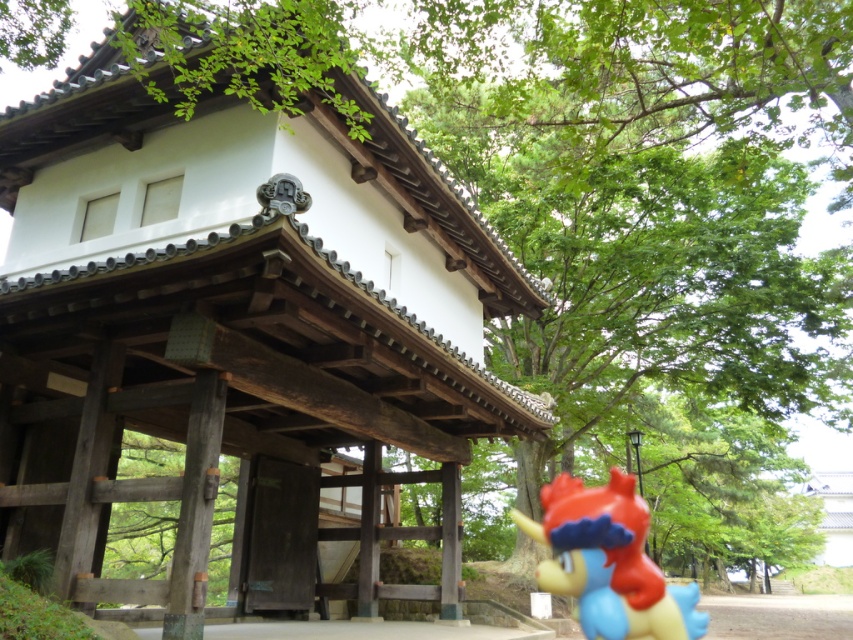
The image size is (853, 640). What are the coordinates of `wooden gate at center` in the screenshot? It's located at (241, 332).

How much distance is there between wooden gate at center and matte plastic toy at center?

They are 18.49 feet apart.

This screenshot has width=853, height=640. In order to click on wooden gate at center in this screenshot , I will do `click(241, 332)`.

Image resolution: width=853 pixels, height=640 pixels. I want to click on wooden gate at center, so click(x=241, y=332).